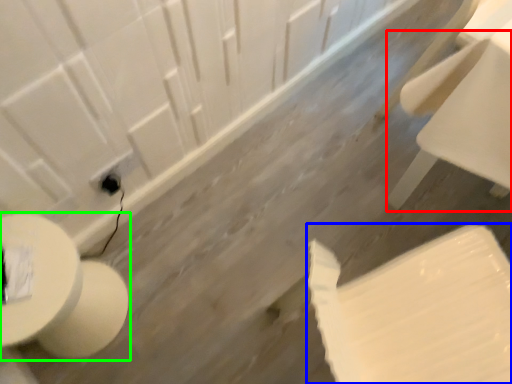
Question: Based on their relative distances, which object is nearer to chair (highlighted by a red box)? Choose from toilet paper (highlighted by a blue box) and toilet (highlighted by a green box).

Choices:
 (A) toilet paper
 (B) toilet

Answer: (A)